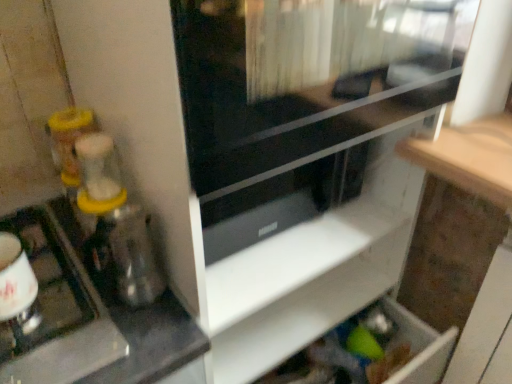
The image size is (512, 384). What do you see at coordinates (298, 288) in the screenshot?
I see `white matte drawer at lower center` at bounding box center [298, 288].

The height and width of the screenshot is (384, 512). I want to click on metallic silver kettle at left, so click(57, 312).

Consider the image. Between transparent plastic blender at left and metallic silver kettle at left, which one is positioned in front?

metallic silver kettle at left is in front.

Between transparent plastic blender at left and metallic silver kettle at left, which one has larger width?

metallic silver kettle at left.

Would you say transparent plastic blender at left is outside metallic silver kettle at left?

transparent plastic blender at left is positioned outside metallic silver kettle at left.

Is transparent plastic blender at left taller or shorter than metallic silver kettle at left?

transparent plastic blender at left is taller than metallic silver kettle at left.

Consider the image. Is transparent plastic blender at left positioned far away from white matte drawer at lower center?

No, transparent plastic blender at left is not far away from white matte drawer at lower center.

Considering the relative sizes of transparent plastic blender at left and white matte drawer at lower center in the image provided, is transparent plastic blender at left wider than white matte drawer at lower center?

In fact, transparent plastic blender at left might be narrower than white matte drawer at lower center.

Which is nearer, (146, 303) or (224, 308)?

Positioned in front is point (146, 303).

Is white matte drawer at lower center completely or partially outside of transparent glass screen door at upper center?

That's correct, white matte drawer at lower center is outside of transparent glass screen door at upper center.

From the image's perspective, is white matte drawer at lower center above or below transparent glass screen door at upper center?

Based on their image positions, white matte drawer at lower center is located beneath transparent glass screen door at upper center.

Is transparent glass screen door at upper center at the back of white matte drawer at lower center?

That's not correct — white matte drawer at lower center is not looking away from transparent glass screen door at upper center.

Is white matte drawer at lower center next to transparent glass screen door at upper center and touching it?

There is a gap between white matte drawer at lower center and transparent glass screen door at upper center.

From the image's perspective, who appears lower, transparent glass screen door at upper center or white matte drawer at lower center?

white matte drawer at lower center.

Is point (199, 32) positioned behind point (384, 257)?

No, it is not.

Considering the relative sizes of transparent glass screen door at upper center and white matte drawer at lower center in the image provided, is transparent glass screen door at upper center taller than white matte drawer at lower center?

Yes.

Which of these two, transparent glass screen door at upper center or white matte drawer at lower center, is wider?

With larger width is transparent glass screen door at upper center.

Is metallic silver kettle at left outside of transparent plastic blender at left?

That's correct, metallic silver kettle at left is outside of transparent plastic blender at left.

From a real-world perspective, is metallic silver kettle at left positioned over transparent plastic blender at left based on gravity?

Actually, metallic silver kettle at left is physically below transparent plastic blender at left in the real world.

Is metallic silver kettle at left far away from transparent plastic blender at left?

metallic silver kettle at left is actually quite close to transparent plastic blender at left.

Can you confirm if metallic silver kettle at left is taller than transparent plastic blender at left?

No, metallic silver kettle at left is not taller than transparent plastic blender at left.

Does transparent plastic blender at left turn towards transparent glass screen door at upper center?

No, transparent plastic blender at left is not turned towards transparent glass screen door at upper center.

Is transparent plastic blender at left far away from transparent glass screen door at upper center?

They are positioned close to each other.

Which of these two, transparent plastic blender at left or transparent glass screen door at upper center, is smaller?

Smaller between the two is transparent plastic blender at left.

Where is `blender below the transparent glass screen door at upper center (from a real-world perspective)`? The width and height of the screenshot is (512, 384). blender below the transparent glass screen door at upper center (from a real-world perspective) is located at coordinates (116, 222).

Between transparent glass screen door at upper center and metallic silver kettle at left, which one is positioned in front?

transparent glass screen door at upper center is more forward.

Is transparent glass screen door at upper center directly adjacent to metallic silver kettle at left?

No, transparent glass screen door at upper center is not in contact with metallic silver kettle at left.

How many degrees apart are the facing directions of transparent glass screen door at upper center and metallic silver kettle at left?

The angle between the facing direction of transparent glass screen door at upper center and the facing direction of metallic silver kettle at left is 0.143 degrees.

Who is smaller, transparent glass screen door at upper center or metallic silver kettle at left?

metallic silver kettle at left is smaller.

Where is `blender above the metallic silver kettle at left (from a real-world perspective)`? The image size is (512, 384). blender above the metallic silver kettle at left (from a real-world perspective) is located at coordinates (116, 222).

The image size is (512, 384). Find the location of `shelf behind the transparent plastic blender at left`. shelf behind the transparent plastic blender at left is located at coordinates (298, 288).

Considering their positions, is transparent plastic blender at left positioned closer to transparent glass screen door at upper center than white matte drawer at lower center?

transparent plastic blender at left lies closer to transparent glass screen door at upper center than the other object.

Considering their positions, is transparent plastic blender at left positioned closer to transparent glass screen door at upper center than metallic silver kettle at left?

transparent plastic blender at left is positioned closer to the anchor transparent glass screen door at upper center.

In the scene shown: Based on their spatial positions, is white matte drawer at lower center or transparent glass screen door at upper center closer to metallic silver kettle at left?

white matte drawer at lower center.

Which object lies further to the anchor point white matte drawer at lower center, transparent plastic blender at left or metallic silver kettle at left?

metallic silver kettle at left.

When comparing their distances from transparent glass screen door at upper center, does metallic silver kettle at left or white matte drawer at lower center seem further?

metallic silver kettle at left is positioned further to the anchor transparent glass screen door at upper center.

When comparing their distances from metallic silver kettle at left, does transparent glass screen door at upper center or white matte drawer at lower center seem closer?

white matte drawer at lower center is closer to metallic silver kettle at left.

Looking at the image, which one is located closer to transparent plastic blender at left, white matte drawer at lower center or transparent glass screen door at upper center?

Based on the image, white matte drawer at lower center appears to be nearer to transparent plastic blender at left.

Considering their positions, is transparent glass screen door at upper center positioned further to metallic silver kettle at left than transparent plastic blender at left?

transparent glass screen door at upper center.

The width and height of the screenshot is (512, 384). Identify the location of appliance between transparent glass screen door at upper center and white matte drawer at lower center in the up-down direction. (57, 312).

What are the coordinates of `blender between metallic silver kettle at left and white matte drawer at lower center in the horizontal direction` in the screenshot? It's located at (116, 222).

This screenshot has width=512, height=384. Identify the location of blender between transparent glass screen door at upper center and white matte drawer at lower center from top to bottom. (116, 222).

Locate an element on the screen. The image size is (512, 384). blender between transparent glass screen door at upper center and metallic silver kettle at left in the up-down direction is located at coordinates (116, 222).